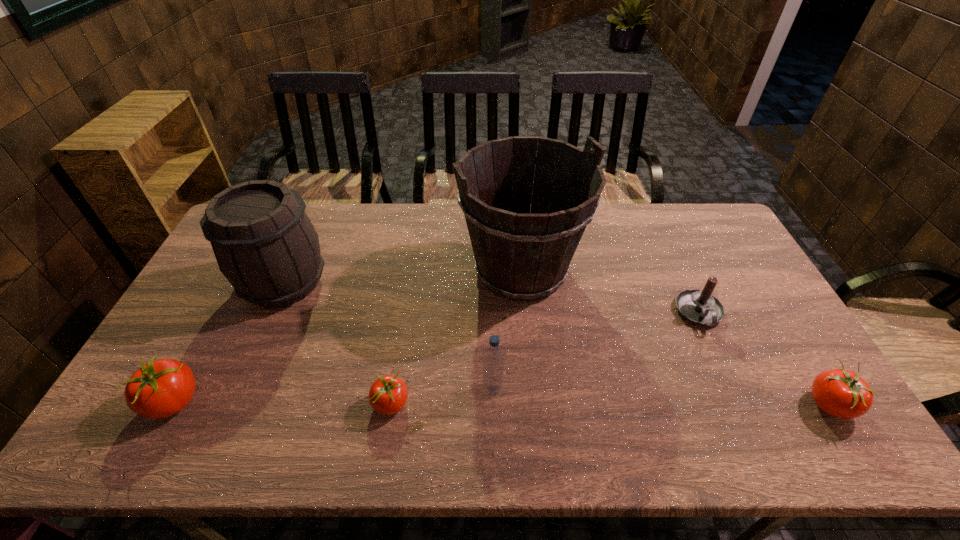
The width and height of the screenshot is (960, 540). I want to click on free location located 0.350m on the back of the third object from left to right, so click(410, 289).

Where is `vacant area located on the left of the sixth tallest object`? vacant area located on the left of the sixth tallest object is located at coordinates (646, 404).

Image resolution: width=960 pixels, height=540 pixels. What are the coordinates of `vacant space situated on the right of the bucket` in the screenshot? It's located at (697, 270).

Find the location of `free point located on the back of the wine bucket`. free point located on the back of the wine bucket is located at coordinates (307, 229).

What are the coordinates of `blank space located on the side of the candle with the handle loop` in the screenshot? It's located at (715, 348).

Image resolution: width=960 pixels, height=540 pixels. I want to click on vacant space located on the right of the fifth shortest object, so click(538, 388).

Image resolution: width=960 pixels, height=540 pixels. I want to click on object that is at the far edge, so click(x=520, y=253).

Locate an element on the screen. This screenshot has width=960, height=540. water bottle present at the near edge is located at coordinates (493, 358).

The image size is (960, 540). I want to click on tomato present at the left edge, so click(x=159, y=389).

The height and width of the screenshot is (540, 960). Find the location of `wine bucket that is at the left edge`. wine bucket that is at the left edge is located at coordinates (266, 246).